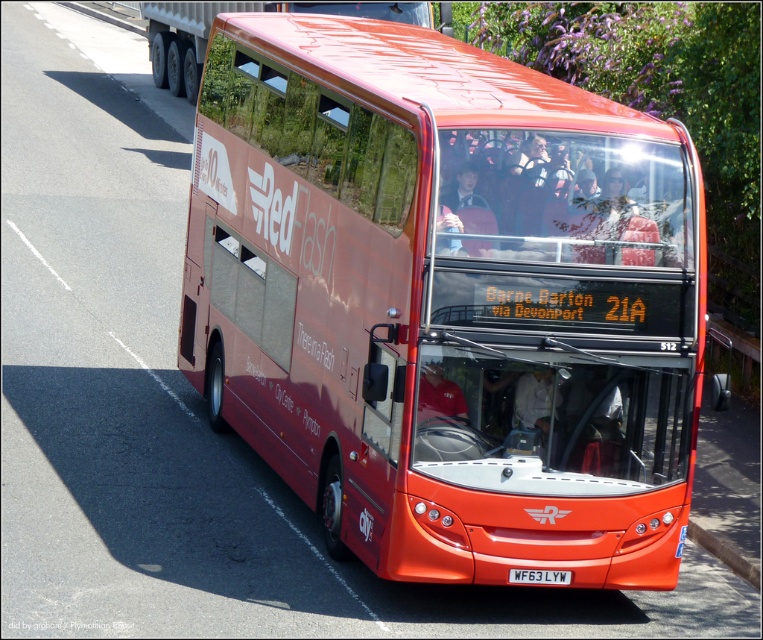
You are a delivery person who needs to place a large package on the roof of the shiny red bus at center. The package requires a minimum clearance of 2.0 meters from the white plastic license plate at center. Can the package be safely placed on the roof?

The distance between the shiny red bus at center and the white plastic license plate at center is 1.90 meters. Since the required clearance is 2.0 meters, the package cannot be safely placed on the roof as it does not meet the minimum distance requirement.

You are a photographer trying to capture a clear shot of the license plate on the shiny red bus at center. Given that the license plate is smaller than the bus, will you need to adjust your camera focus to ensure the white plastic license plate at center is sharp?

The shiny red bus at center is taller than the white plastic license plate at center, but the license plate is still the focal point for clarity. To ensure the white plastic license plate at center is sharp, adjust your camera focus specifically on it since it is smaller and may require closer attention.